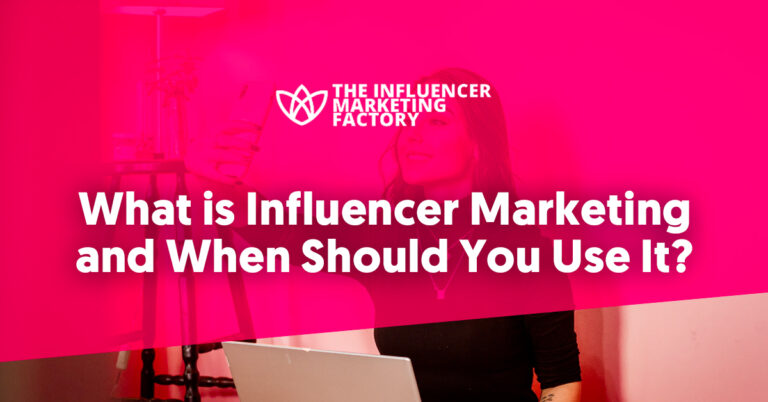
In order to click on pink light in this screenshot , I will do `click(73, 377)`.